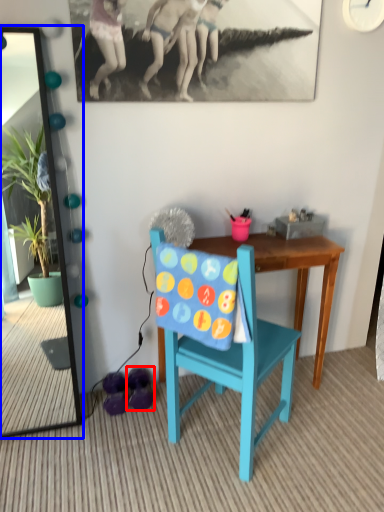
Question: Which object appears farthest to the camera in this image, footwear (highlighted by a red box) or mirror (highlighted by a blue box)?

Choices:
 (A) footwear
 (B) mirror

Answer: (A)